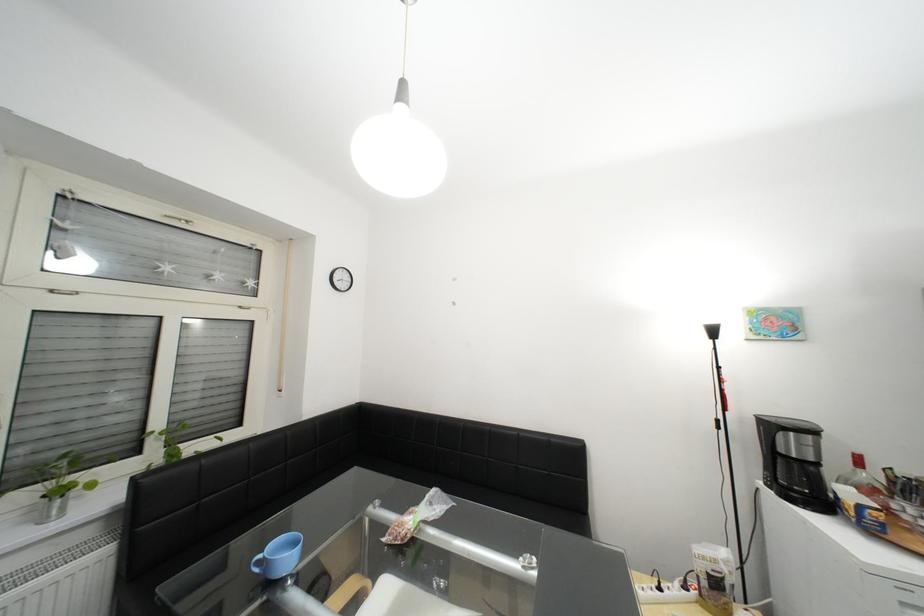
Image resolution: width=924 pixels, height=616 pixels. In order to click on lamp switch in this screenshot , I will do pyautogui.click(x=719, y=424).